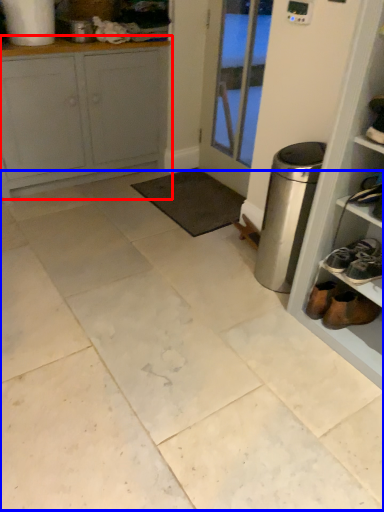
Question: Which object appears farthest to the camera in this image, cabinetry (highlighted by a red box) or ceramic tile (highlighted by a blue box)?

Choices:
 (A) cabinetry
 (B) ceramic tile

Answer: (A)